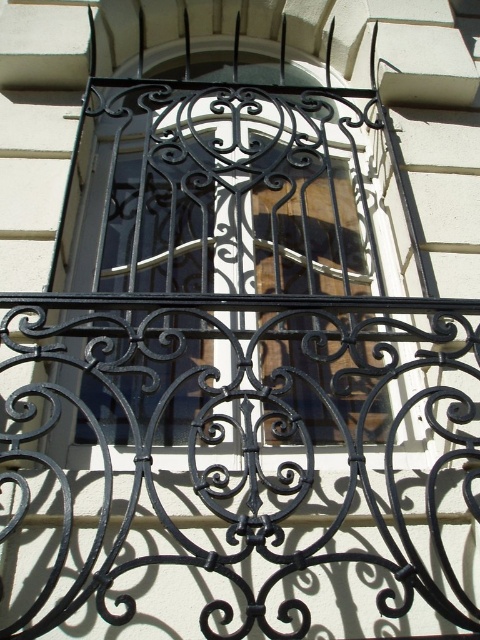
You are an architect examining the ornate wrought iron window grille. You notice two points on the grille at coordinates point (196, 452) and point (297, 188). Which point is positioned closer to your viewpoint?

Point (196, 452) is closer to the viewer than point (297, 188).

You are an architect designing a new building and want to ensure the black wrought iron balcony at center and the black wrought iron at center are proportionate. Which of the two objects is larger in size?

The black wrought iron balcony at center is bigger than the black wrought iron at center, so the balcony should be designed to be larger to maintain proportion.